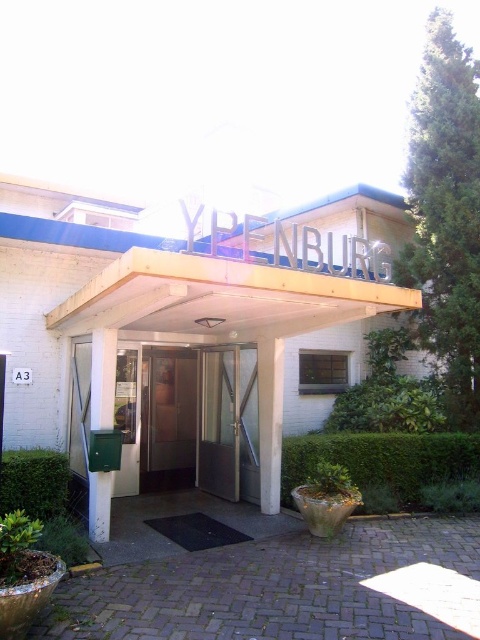
Question: Which point is farther to the camera?

Choices:
 (A) metallic glass door at center
 (B) white wooden entrance at center

Answer: (A)

Question: Which object appears farthest from the camera in this image?

Choices:
 (A) white wooden entrance at center
 (B) metallic glass door at center

Answer: (B)

Question: Does white wooden entrance at center have a larger size compared to metallic glass door at center?

Choices:
 (A) no
 (B) yes

Answer: (A)

Question: Does white wooden entrance at center come behind metallic glass door at center?

Choices:
 (A) no
 (B) yes

Answer: (A)

Question: Does white wooden entrance at center have a lesser width compared to metallic glass door at center?

Choices:
 (A) yes
 (B) no

Answer: (A)

Question: Which object appears farthest from the camera in this image?

Choices:
 (A) white wooden entrance at center
 (B) metallic glass door at center

Answer: (B)